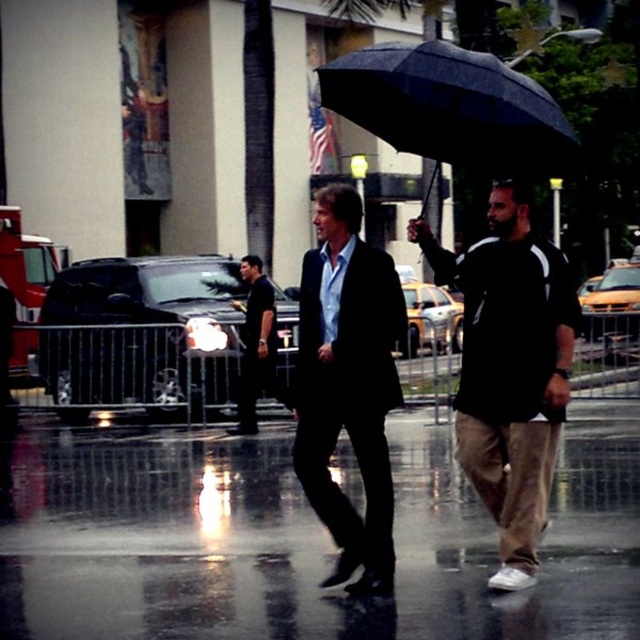
Based on the photo, can you confirm if black matte umbrella at right is positioned to the right of black matte shirt at center?

Correct, you'll find black matte umbrella at right to the right of black matte shirt at center.

Who is shorter, black matte umbrella at right or black matte shirt at center?

black matte shirt at center

Between point (556, 324) and point (256, 369), which one is positioned behind?

The point (256, 369) is behind.

Identify the location of black matte umbrella at right. (509, 371).

Does glossy asphalt pavement at center have a lesser width compared to black matte umbrella at right?

No, glossy asphalt pavement at center is not thinner than black matte umbrella at right.

Where is `glossy asphalt pavement at center`? This screenshot has width=640, height=640. glossy asphalt pavement at center is located at coordinates (305, 540).

The image size is (640, 640). In order to click on glossy asphalt pavement at center in this screenshot , I will do `click(305, 540)`.

Is point (68, 627) positioned before point (246, 433)?

That is True.

Does glossy asphalt pavement at center have a smaller size compared to black matte shirt at center?

Incorrect, glossy asphalt pavement at center is not smaller in size than black matte shirt at center.

Does point (49, 554) come farther from viewer compared to point (246, 362)?

No.

What are the coordinates of `glossy asphalt pavement at center` in the screenshot? It's located at (305, 540).